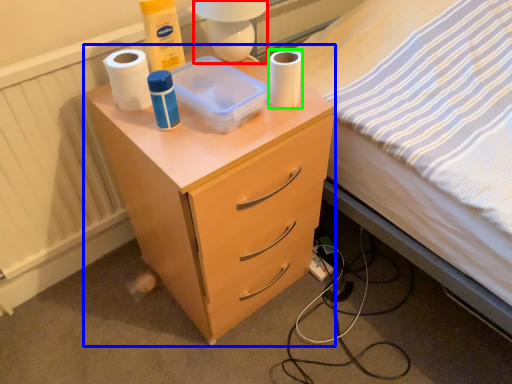
Question: Estimate the real-world distances between objects in this image. Which object is farther from lamp (highlighted by a red box), nightstand (highlighted by a blue box) or toilet paper (highlighted by a green box)?

Choices:
 (A) nightstand
 (B) toilet paper

Answer: (A)